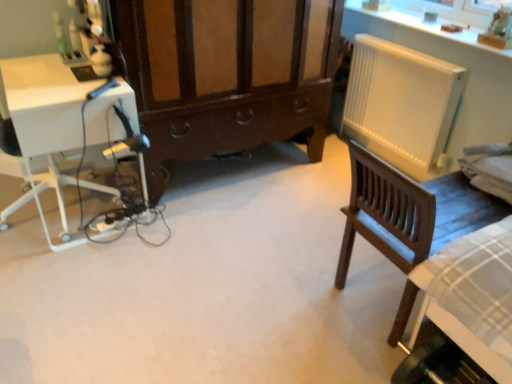
Locate an element on the screen. Image resolution: width=512 pixels, height=384 pixels. vacant area that lies to the right of white plastic computer desk at left is located at coordinates (190, 235).